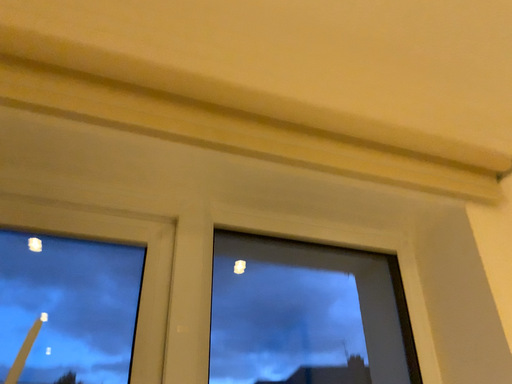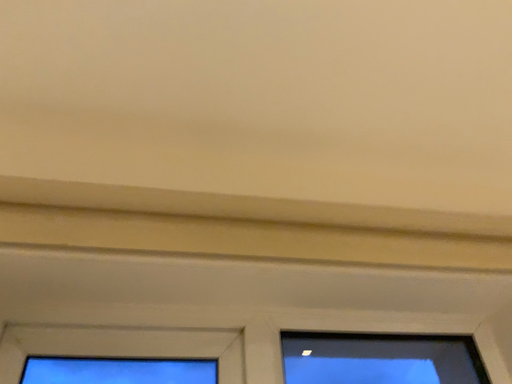
Question: How did the camera likely rotate when shooting the video?

Choices:
 (A) rotated upward
 (B) rotated downward

Answer: (A)